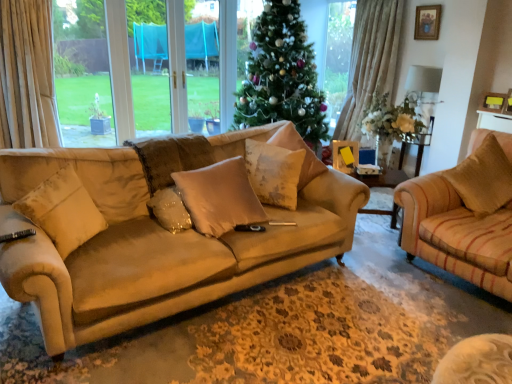
Question: From a real-world perspective, is beige fabric pillow at center, the fourth pillow in the left-to-right sequence, physically above beige suede pillow at left, the first pillow from the left?

Choices:
 (A) yes
 (B) no

Answer: (A)

Question: Is beige fabric pillow at center, placed as the 2th pillow when sorted from right to left, shorter than beige suede pillow at left, the first pillow from the left?

Choices:
 (A) yes
 (B) no

Answer: (A)

Question: Is beige suede pillow at left, the first pillow from the left, a part of beige fabric pillow at center, placed as the 2th pillow when sorted from right to left?

Choices:
 (A) no
 (B) yes

Answer: (A)

Question: Considering the relative sizes of beige fabric pillow at center, the fourth pillow in the left-to-right sequence, and beige suede pillow at left, the first pillow from the left, in the image provided, is beige fabric pillow at center, the fourth pillow in the left-to-right sequence, wider than beige suede pillow at left, the first pillow from the left,?

Choices:
 (A) yes
 (B) no

Answer: (A)

Question: Can you confirm if beige fabric pillow at center, placed as the 2th pillow when sorted from right to left, is taller than beige suede pillow at left, which appears as the 5th pillow when viewed from the right?

Choices:
 (A) no
 (B) yes

Answer: (A)

Question: Could you tell me if beige fabric pillow at center, the fourth pillow in the left-to-right sequence, is facing beige suede pillow at left, which appears as the 5th pillow when viewed from the right?

Choices:
 (A) no
 (B) yes

Answer: (A)

Question: From the image's perspective, does fluffy beige pillow at center, which is the third pillow from left to right, appear higher than wooden side table at center?

Choices:
 (A) yes
 (B) no

Answer: (A)

Question: Does fluffy beige pillow at center, which is the third pillow from left to right, appear on the right side of wooden side table at center?

Choices:
 (A) yes
 (B) no

Answer: (B)

Question: Considering the relative positions of fluffy beige pillow at center, which is the third pillow from left to right, and wooden side table at center in the image provided, is fluffy beige pillow at center, which is the third pillow from left to right, behind wooden side table at center?

Choices:
 (A) yes
 (B) no

Answer: (B)

Question: Could you tell me if fluffy beige pillow at center, arranged as the 3th pillow when viewed from the right, is turned towards wooden side table at center?

Choices:
 (A) yes
 (B) no

Answer: (B)

Question: Considering the relative sizes of fluffy beige pillow at center, which is the third pillow from left to right, and wooden side table at center in the image provided, is fluffy beige pillow at center, which is the third pillow from left to right, taller than wooden side table at center?

Choices:
 (A) no
 (B) yes

Answer: (A)

Question: Can you confirm if fluffy beige pillow at center, which is the third pillow from left to right, is thinner than wooden side table at center?

Choices:
 (A) no
 (B) yes

Answer: (B)

Question: Is fluffy beige pillow at center, arranged as the 3th pillow when viewed from the right, looking in the opposite direction of brown textured pillow at right, arranged as the 1th pillow when viewed from the right?

Choices:
 (A) no
 (B) yes

Answer: (A)